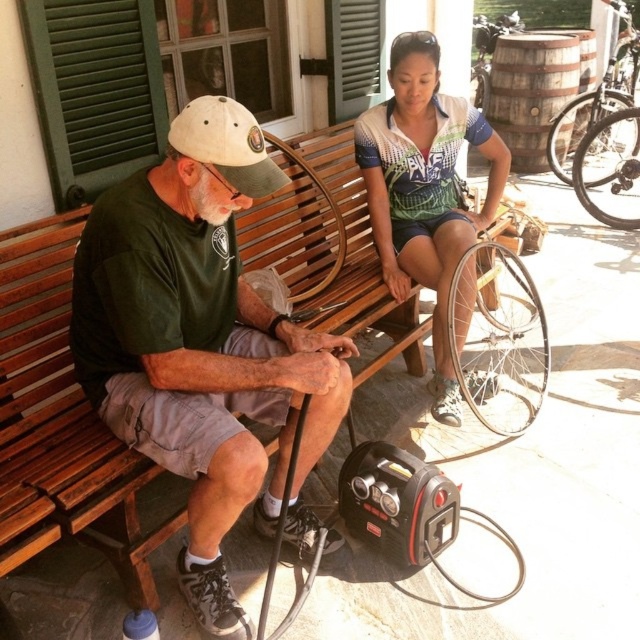
Which is below, white matte baseball cap at left or silver metallic bicycle wheel at right?

white matte baseball cap at left is lower down.

How distant is white matte baseball cap at left from silver metallic bicycle wheel at right?

white matte baseball cap at left and silver metallic bicycle wheel at right are 4.54 meters apart from each other.

You are a GUI agent. You are given a task and a screenshot of the screen. Output one action in this format:
    pyautogui.click(x=<x>, y=<y>)
    Task: Click on the white matte baseball cap at left
    This screenshot has width=640, height=640.
    Given the screenshot: What is the action you would take?
    pyautogui.click(x=227, y=145)

Between point (497, 193) and point (188, 115), which one is positioned behind?

Point (497, 193)

Locate an element on the screen. The height and width of the screenshot is (640, 640). white jersey at upper center is located at coordinates (424, 188).

You are a GUI agent. You are given a task and a screenshot of the screen. Output one action in this format:
    pyautogui.click(x=<x>, y=<y>)
    Task: Click on the white jersey at upper center
    The width and height of the screenshot is (640, 640).
    Given the screenshot: What is the action you would take?
    pyautogui.click(x=424, y=188)

Where is `white jersey at upper center`? The height and width of the screenshot is (640, 640). white jersey at upper center is located at coordinates (424, 188).

Who is positioned more to the right, white jersey at upper center or silver metallic bicycle wheel at right?

From the viewer's perspective, silver metallic bicycle wheel at right appears more on the right side.

Does point (433, 257) come closer to viewer compared to point (618, 104)?

Yes, point (433, 257) is in front of point (618, 104).

Image resolution: width=640 pixels, height=640 pixels. Describe the element at coordinates (424, 188) in the screenshot. I see `white jersey at upper center` at that location.

Identify the location of white jersey at upper center. (424, 188).